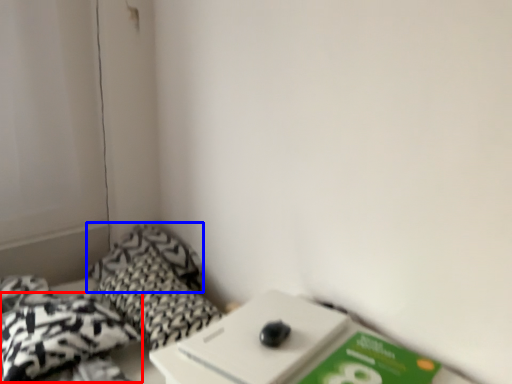
Question: Which point is closer to the camera, throw pillow (highlighted by a red box) or pillow (highlighted by a blue box)?

Choices:
 (A) throw pillow
 (B) pillow

Answer: (A)